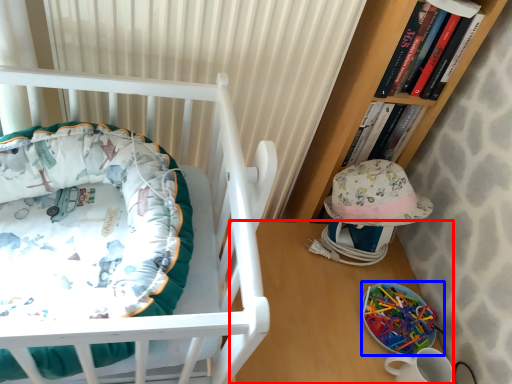
Question: Which point is further to the camera, table (highlighted by a red box) or equipment (highlighted by a blue box)?

Choices:
 (A) table
 (B) equipment

Answer: (B)